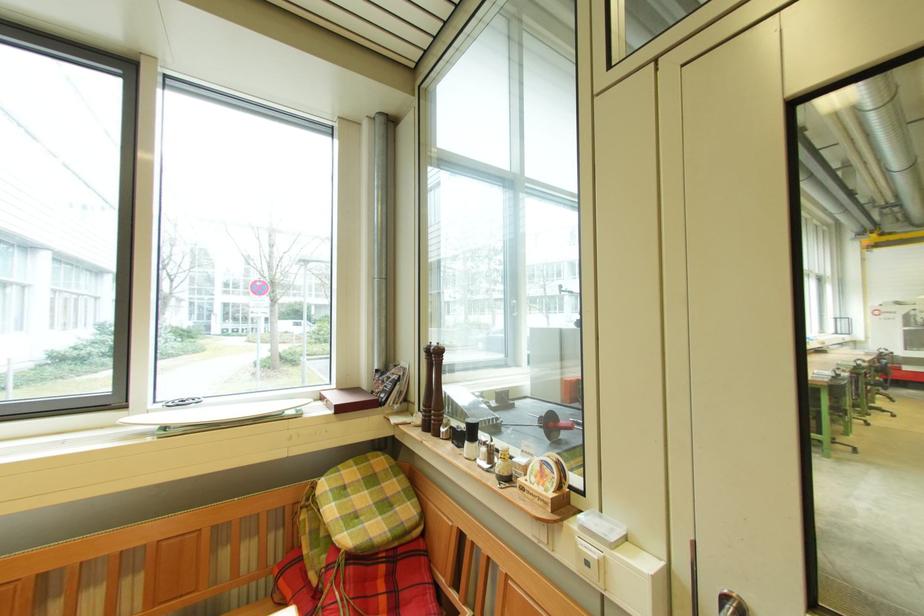
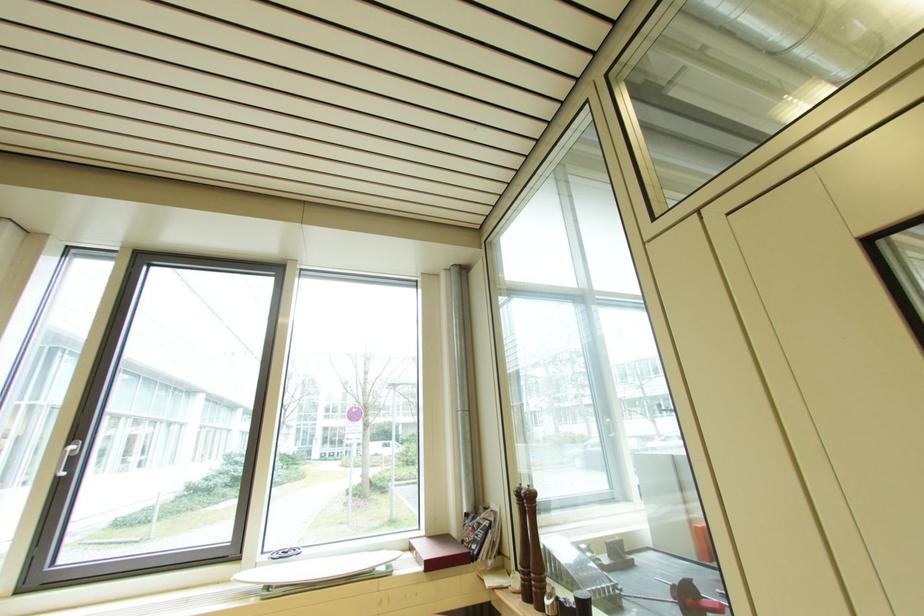
Question: What movement of the cameraman would produce the second image?

Choices:
 (A) Left
 (B) Right
 (C) Forward
 (D) Backward

Answer: (D)